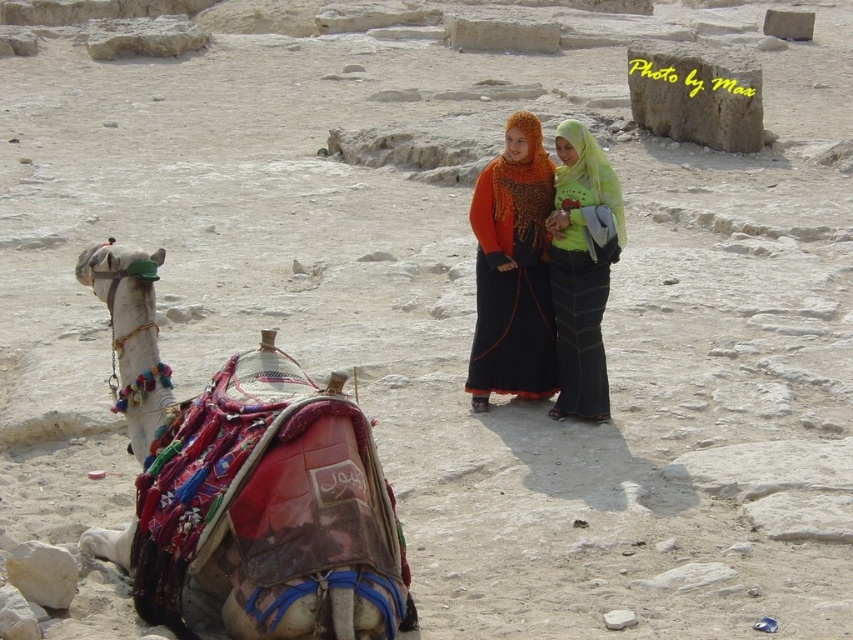
You are a traveler in the desert and you want to know which of the two items at the center is narrower between the orange knitted scarf at center and the green fabric hijab at center?

The orange knitted scarf at center is narrower than the green fabric hijab at center.

You are a photographer planning to take a photo of the desert scene. You want to ensure that the decorative fabric camel at left is centered in your shot. Based on its current position at point 0.758, 0.290, what adjustment should you make to the camera frame to center it?

To center the decorative fabric camel at left, adjust the camera frame so that its position moves from point (247, 484) to the center coordinates of the image, which is typically at point (426, 320). This would require moving the frame slightly to the left and upwards.